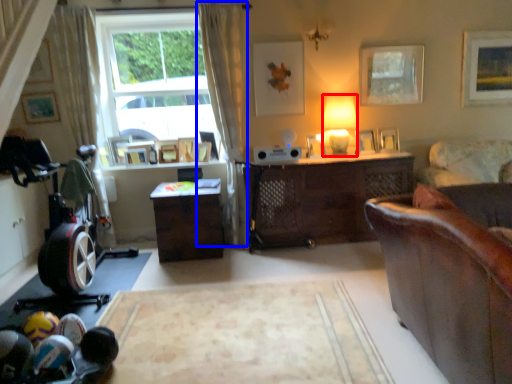
Question: Among these objects, which one is nearest to the camera, lamp (highlighted by a red box) or curtain (highlighted by a blue box)?

Choices:
 (A) lamp
 (B) curtain

Answer: (B)